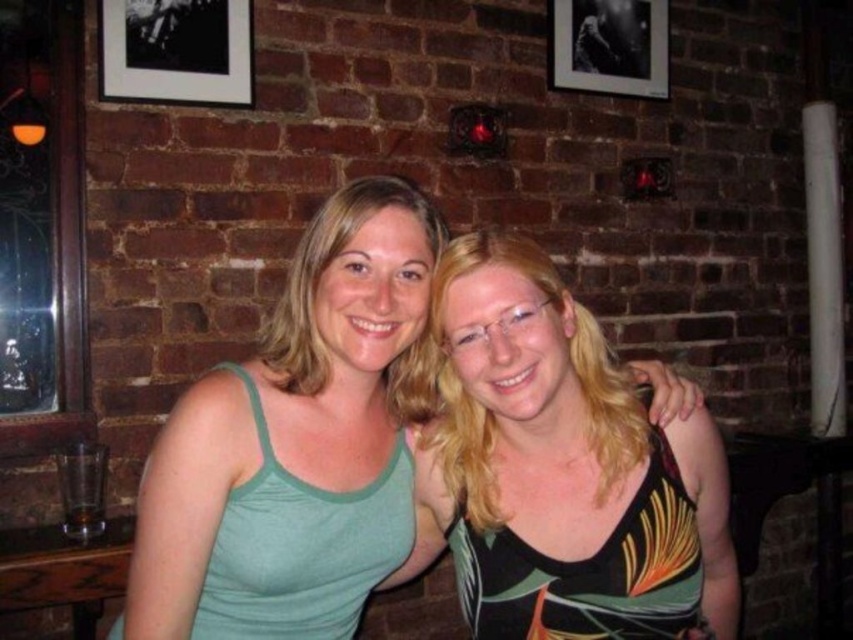
Question: Which point is farther from the camera taking this photo?

Choices:
 (A) pyautogui.click(x=271, y=609)
 (B) pyautogui.click(x=231, y=68)
 (C) pyautogui.click(x=598, y=12)

Answer: (C)

Question: Can you confirm if green fabric tank top at center is positioned above black matte picture frame at upper right?

Choices:
 (A) no
 (B) yes

Answer: (A)

Question: Which point appears farthest from the camera in this image?

Choices:
 (A) (518, 408)
 (B) (405, 474)

Answer: (B)

Question: Which point is closer to the camera taking this photo?

Choices:
 (A) (167, 630)
 (B) (494, 536)
 (C) (103, 90)
 (D) (595, 32)

Answer: (A)

Question: Does black matte picture frame at upper left come in front of black matte picture frame at upper right?

Choices:
 (A) no
 (B) yes

Answer: (B)

Question: Does green fabric tank top at center come behind black matte picture frame at upper left?

Choices:
 (A) yes
 (B) no

Answer: (B)